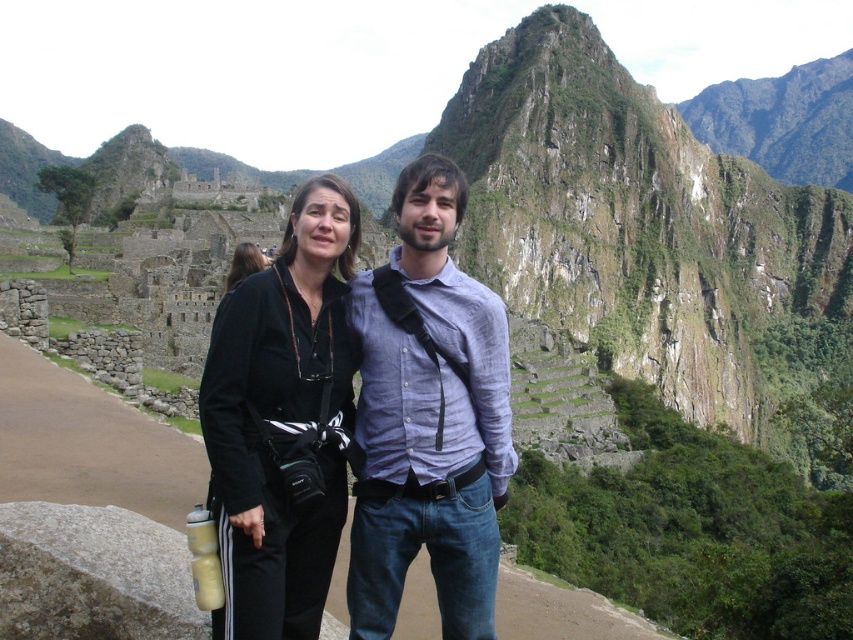
Between light blue linen shirt at center and black fabric jacket at center, which one has more height?

black fabric jacket at center

What do you see at coordinates (428, 417) in the screenshot? The image size is (853, 640). I see `light blue linen shirt at center` at bounding box center [428, 417].

Between point (463, 356) and point (222, 616), which one is positioned behind?

The point (463, 356) is behind.

The height and width of the screenshot is (640, 853). Identify the location of light blue linen shirt at center. (428, 417).

Is light blue linen shirt at center shorter than black fabric camera at center?

No, light blue linen shirt at center is not shorter than black fabric camera at center.

Is light blue linen shirt at center taller than black fabric camera at center?

Correct, light blue linen shirt at center is much taller as black fabric camera at center.

Where is `light blue linen shirt at center`? Image resolution: width=853 pixels, height=640 pixels. light blue linen shirt at center is located at coordinates (428, 417).

Is black fabric jacket at center positioned at the back of black fabric camera at center?

No, it is in front of black fabric camera at center.

Identify the location of black fabric jacket at center. [x=283, y=422].